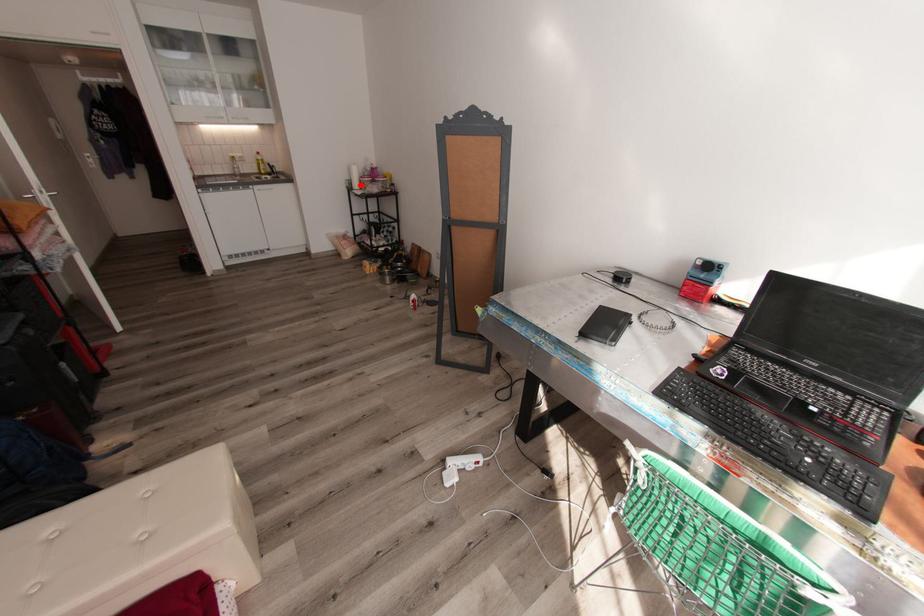
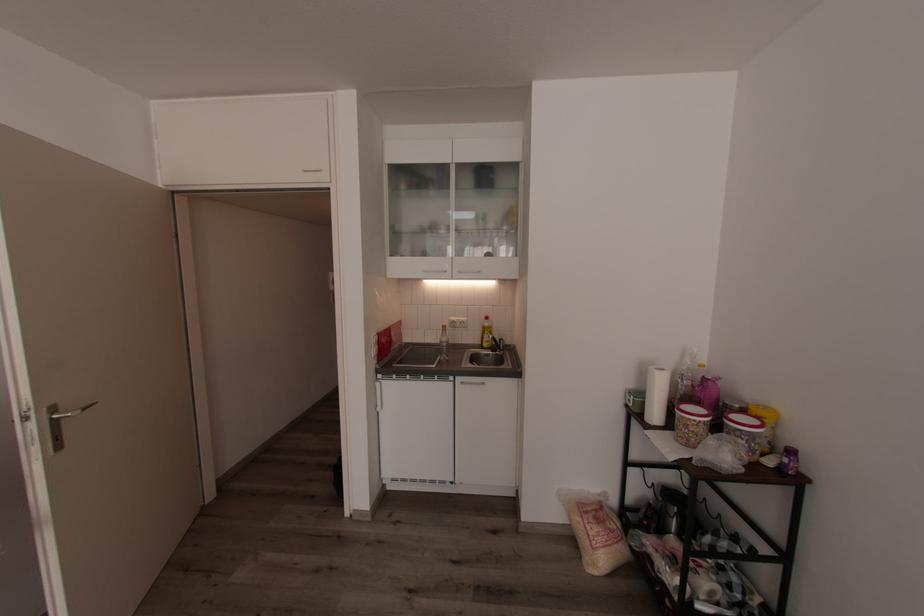
Question: I am providing you with two images of the same scene from different viewpoints. Given a red point in image1, look at the same physical point in image2. Is it:

Choices:
 (A) Closer to the viewpoint
 (B) Farther from the viewpoint

Answer: (B)